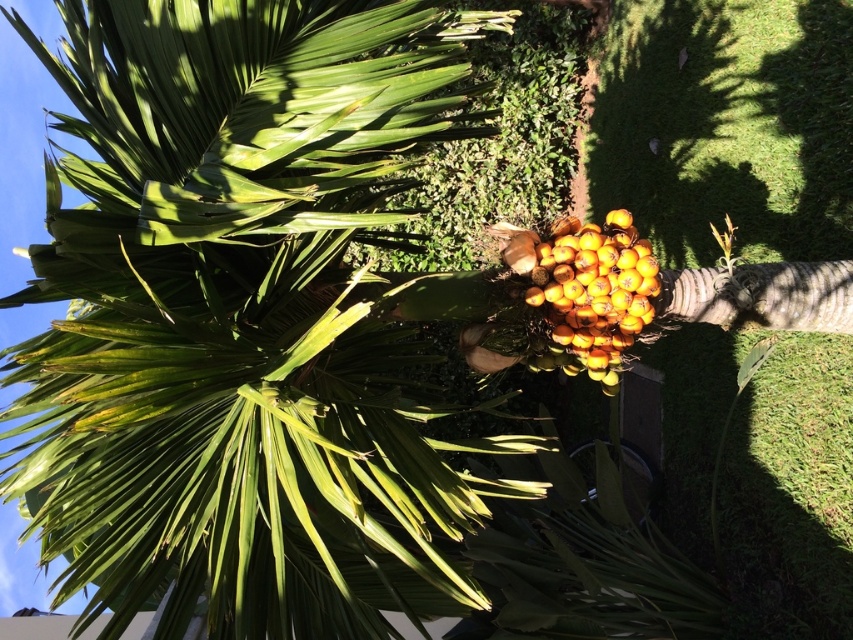
Is green leafy coconut tree at center positioned at the back of yellow matte fruit at center?

No, it is not.

Is green leafy coconut tree at center bigger than yellow matte fruit at center?

Yes.

Find the location of a particular element. green leafy coconut tree at center is located at coordinates (242, 317).

Identify the location of green leafy coconut tree at center. (242, 317).